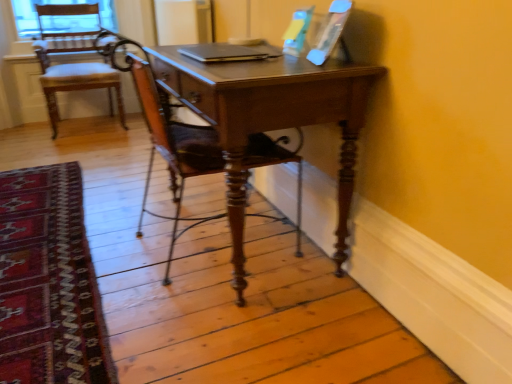
Question: Is wooden chair at left, the first chair from the back, a part of carpet with intricate patterns at lower left?

Choices:
 (A) yes
 (B) no

Answer: (B)

Question: Is carpet with intricate patterns at lower left positioned in front of wooden chair at left, the first chair from the back?

Choices:
 (A) no
 (B) yes

Answer: (B)

Question: Is carpet with intricate patterns at lower left looking in the opposite direction of wooden chair at left, the first chair from the back?

Choices:
 (A) no
 (B) yes

Answer: (A)

Question: Does carpet with intricate patterns at lower left have a lesser width compared to wooden chair at left, positioned as the 2th chair in right-to-left order?

Choices:
 (A) yes
 (B) no

Answer: (B)

Question: Does carpet with intricate patterns at lower left have a smaller size compared to wooden chair at left, the first chair from the back?

Choices:
 (A) yes
 (B) no

Answer: (A)

Question: From a real-world perspective, is carpet with intricate patterns at lower left physically located above or below wooden polished chair at center, the first chair in the front-to-back sequence?

Choices:
 (A) below
 (B) above

Answer: (A)

Question: Is carpet with intricate patterns at lower left in front of or behind wooden polished chair at center, the first chair viewed from the right, in the image?

Choices:
 (A) front
 (B) behind

Answer: (A)

Question: Is carpet with intricate patterns at lower left taller or shorter than wooden polished chair at center, the 2th chair positioned from the left?

Choices:
 (A) short
 (B) tall

Answer: (A)

Question: From the image's perspective, relative to wooden polished chair at center, the 2th chair positioned from the left, is carpet with intricate patterns at lower left above or below?

Choices:
 (A) below
 (B) above

Answer: (A)

Question: Is silver metallic laptop at center wider or thinner than carpet with intricate patterns at lower left?

Choices:
 (A) thin
 (B) wide

Answer: (A)

Question: Based on their positions, is silver metallic laptop at center located to the left or right of carpet with intricate patterns at lower left?

Choices:
 (A) right
 (B) left

Answer: (A)

Question: Considering the positions of point (244, 57) and point (98, 314), is point (244, 57) closer or farther from the camera than point (98, 314)?

Choices:
 (A) farther
 (B) closer

Answer: (A)

Question: Is silver metallic laptop at center taller or shorter than carpet with intricate patterns at lower left?

Choices:
 (A) tall
 (B) short

Answer: (B)

Question: In terms of size, does silver metallic laptop at center appear bigger or smaller than wooden chair at left, the 1th chair viewed from the left?

Choices:
 (A) small
 (B) big

Answer: (A)

Question: In the image, is silver metallic laptop at center on the left side or the right side of wooden chair at left, the 1th chair viewed from the left?

Choices:
 (A) left
 (B) right

Answer: (B)